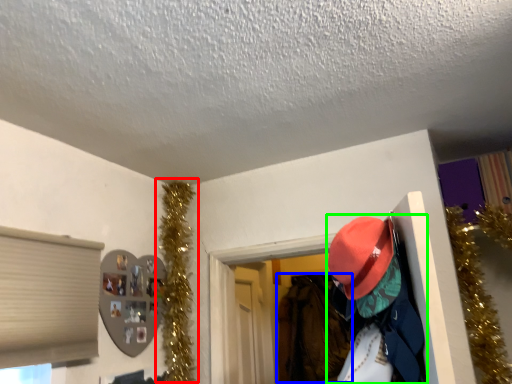
Question: Which object is the farthest from christmas decoration (highlighted by a red box)? Choose among these: clothing (highlighted by a blue box) or person (highlighted by a green box).

Choices:
 (A) clothing
 (B) person

Answer: (A)